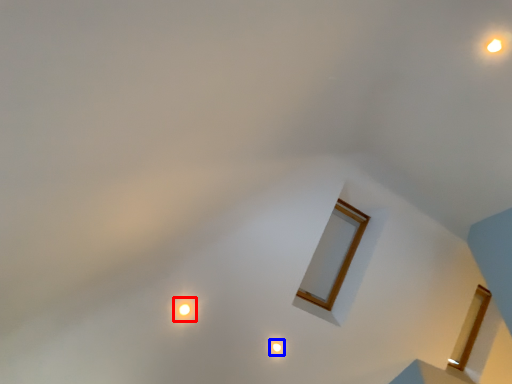
Question: Which point is closer to the camera, glow (highlighted by a red box) or light (highlighted by a blue box)?

Choices:
 (A) glow
 (B) light

Answer: (A)